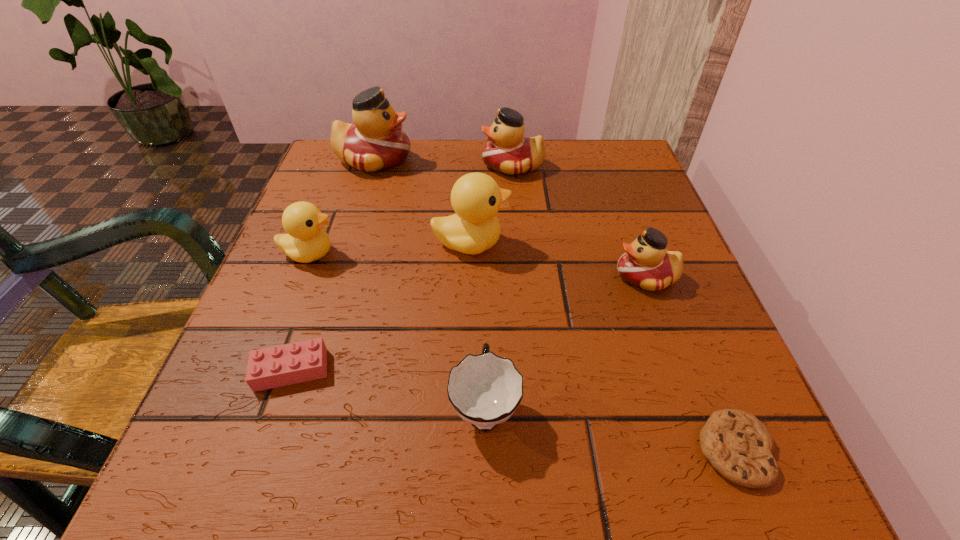
Locate an element on the screen. The image size is (960, 540). cookie that is at the right edge is located at coordinates (737, 444).

Where is `object that is at the far left corner`? The height and width of the screenshot is (540, 960). object that is at the far left corner is located at coordinates (375, 142).

Locate an element on the screen. The height and width of the screenshot is (540, 960). object present at the near right corner is located at coordinates (737, 444).

The width and height of the screenshot is (960, 540). Identify the location of free region at the far edge of the desktop. (457, 179).

Where is `free space at the near edge of the desktop`? This screenshot has width=960, height=540. free space at the near edge of the desktop is located at coordinates (423, 494).

At what (x,y) coordinates should I click in order to perform the action: click on vacant space at the left edge. Please return your answer as a coordinate pair (x, y). Looking at the image, I should click on (363, 242).

At what (x,y) coordinates should I click in order to perform the action: click on vacant space at the right edge of the desktop. Please return your answer as a coordinate pair (x, y). The height and width of the screenshot is (540, 960). Looking at the image, I should click on (648, 410).

This screenshot has height=540, width=960. What are the coordinates of `vacant area at the near left corner of the desktop` in the screenshot? It's located at (300, 453).

This screenshot has width=960, height=540. In order to click on vacant space at the far right corner in this screenshot , I will do `click(619, 147)`.

At what (x,y) coordinates should I click in order to perform the action: click on blank space at the near right corner. Please return your answer as a coordinate pair (x, y). This screenshot has width=960, height=540. Looking at the image, I should click on (666, 434).